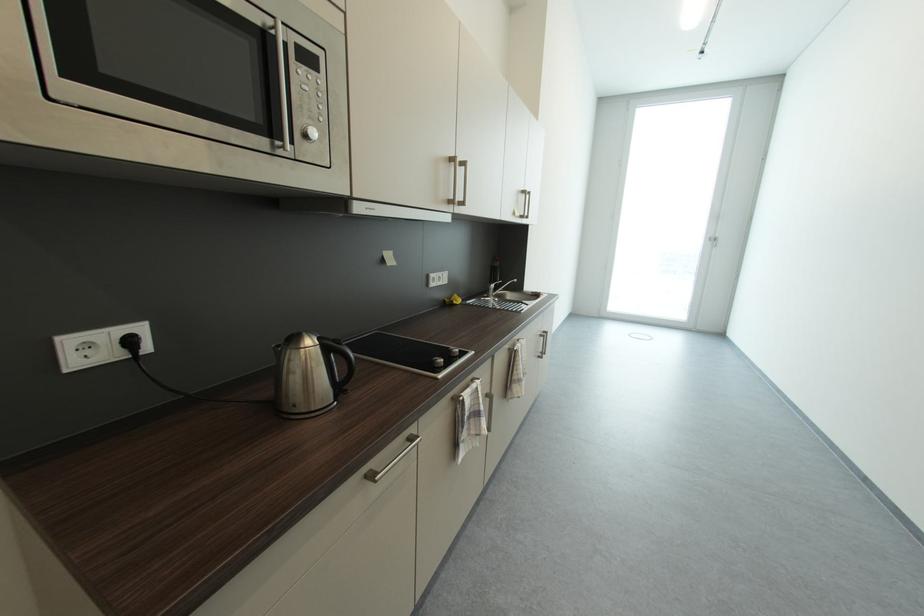
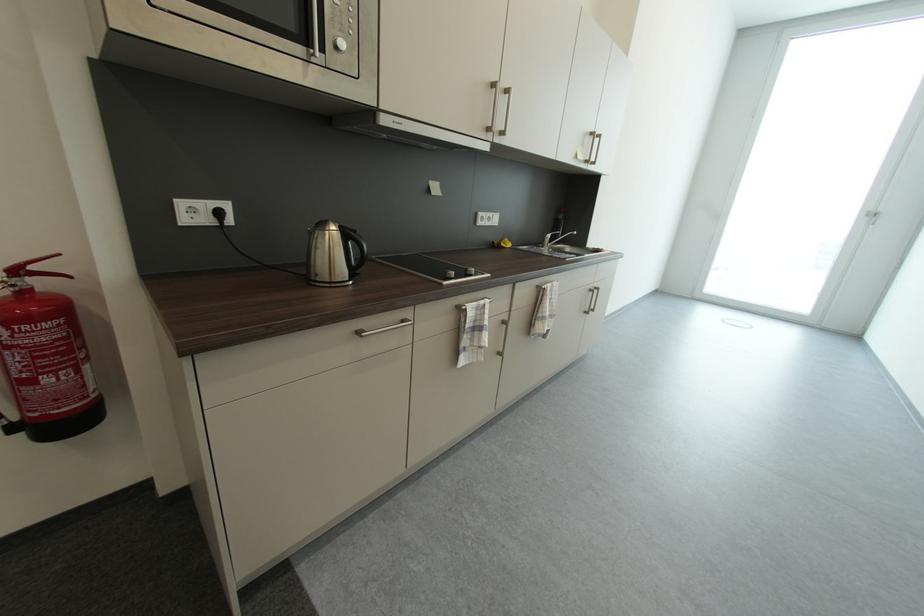
In the second image, find the point that corresponds to (323,342) in the first image.

(346, 228)